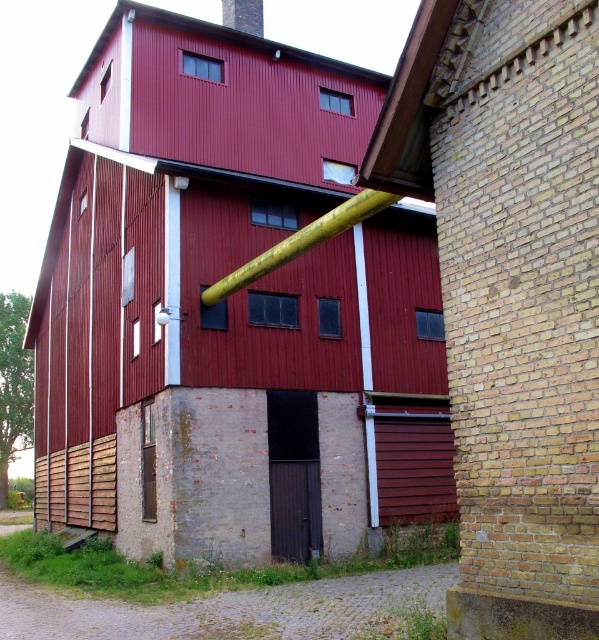
Question: From the image, what is the correct spatial relationship of metallic red barn at center in relation to yellow matte pipe at center?

Choices:
 (A) right
 (B) left

Answer: (B)

Question: Estimate the real-world distances between objects in this image. Which object is farther from the red corrugated metal barn at center?

Choices:
 (A) yellow matte pipe at center
 (B) metallic red barn at center
 (C) smooth yellow pipe at upper center

Answer: (C)

Question: Is yellow matte pipe at center to the left of smooth yellow pipe at upper center from the viewer's perspective?

Choices:
 (A) yes
 (B) no

Answer: (B)

Question: Among these objects, which one is farthest from the camera?

Choices:
 (A) red corrugated metal barn at center
 (B) metallic red barn at center

Answer: (B)

Question: Which is farther from the smooth yellow pipe at upper center?

Choices:
 (A) red corrugated metal barn at center
 (B) yellow matte pipe at center
 (C) metallic red barn at center

Answer: (A)

Question: Does red corrugated metal barn at center appear over yellow matte pipe at center?

Choices:
 (A) no
 (B) yes

Answer: (B)